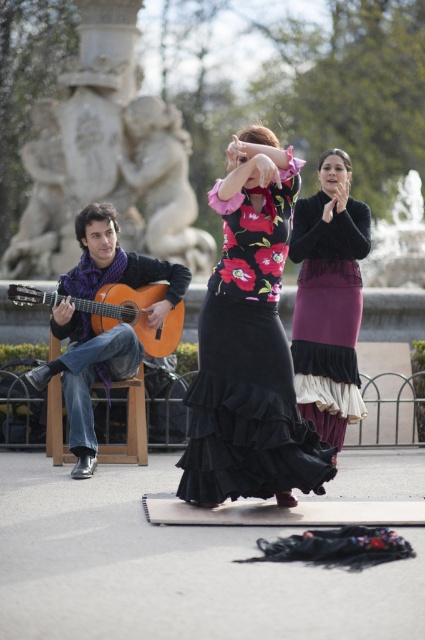
Is black satin dress at center to the right of velvet purple skirt at center from the viewer's perspective?

Incorrect, black satin dress at center is not on the right side of velvet purple skirt at center.

I want to click on black satin dress at center, so (x=249, y=369).

Identify the location of black satin dress at center. (249, 369).

Is matte orange guitar at left taller than orange wood guitar at left?

Yes, matte orange guitar at left is taller than orange wood guitar at left.

Is matte orange guitar at left bigger than orange wood guitar at left?

Correct, matte orange guitar at left is larger in size than orange wood guitar at left.

Does point (139, 259) lie in front of point (99, 301)?

No, it is behind (99, 301).

Where is `matte orange guitar at left`? The width and height of the screenshot is (425, 640). matte orange guitar at left is located at coordinates (107, 330).

Is velvet purple skirt at center in front of matte orange guitar at left?

No, it is behind matte orange guitar at left.

Measure the distance between velvet purple skirt at center and matte orange guitar at left.

They are 9.60 feet apart.

The width and height of the screenshot is (425, 640). What do you see at coordinates (328, 300) in the screenshot?
I see `velvet purple skirt at center` at bounding box center [328, 300].

Identify the location of velvet purple skirt at center. (x=328, y=300).